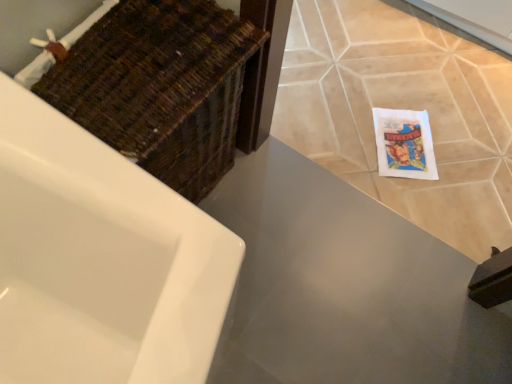
Question: Considering the relative positions of woven brown basket at upper left and matte gray countertop at center in the image provided, is woven brown basket at upper left behind matte gray countertop at center?

Choices:
 (A) no
 (B) yes

Answer: (A)

Question: Is woven brown basket at upper left bigger than matte gray countertop at center?

Choices:
 (A) no
 (B) yes

Answer: (B)

Question: Is woven brown basket at upper left to the left of matte gray countertop at center from the viewer's perspective?

Choices:
 (A) no
 (B) yes

Answer: (B)

Question: Is woven brown basket at upper left positioned far away from matte gray countertop at center?

Choices:
 (A) no
 (B) yes

Answer: (A)

Question: From the image's perspective, does woven brown basket at upper left appear higher than matte gray countertop at center?

Choices:
 (A) no
 (B) yes

Answer: (B)

Question: Are woven brown basket at upper left and matte gray countertop at center beside each other?

Choices:
 (A) no
 (B) yes

Answer: (A)

Question: Is woven brown basket at upper left positioned far away from beige ceramic tile at lower right?

Choices:
 (A) yes
 (B) no

Answer: (B)

Question: Considering the relative sizes of woven brown basket at upper left and beige ceramic tile at lower right in the image provided, is woven brown basket at upper left bigger than beige ceramic tile at lower right?

Choices:
 (A) yes
 (B) no

Answer: (A)

Question: Is woven brown basket at upper left shorter than beige ceramic tile at lower right?

Choices:
 (A) no
 (B) yes

Answer: (A)

Question: Is woven brown basket at upper left turned away from beige ceramic tile at lower right?

Choices:
 (A) yes
 (B) no

Answer: (B)

Question: Considering the relative sizes of woven brown basket at upper left and beige ceramic tile at lower right in the image provided, is woven brown basket at upper left thinner than beige ceramic tile at lower right?

Choices:
 (A) no
 (B) yes

Answer: (B)

Question: Does woven brown basket at upper left have a smaller size compared to beige ceramic tile at lower right?

Choices:
 (A) no
 (B) yes

Answer: (A)

Question: Does matte gray countertop at center have a larger size compared to beige ceramic tile at lower right?

Choices:
 (A) yes
 (B) no

Answer: (B)